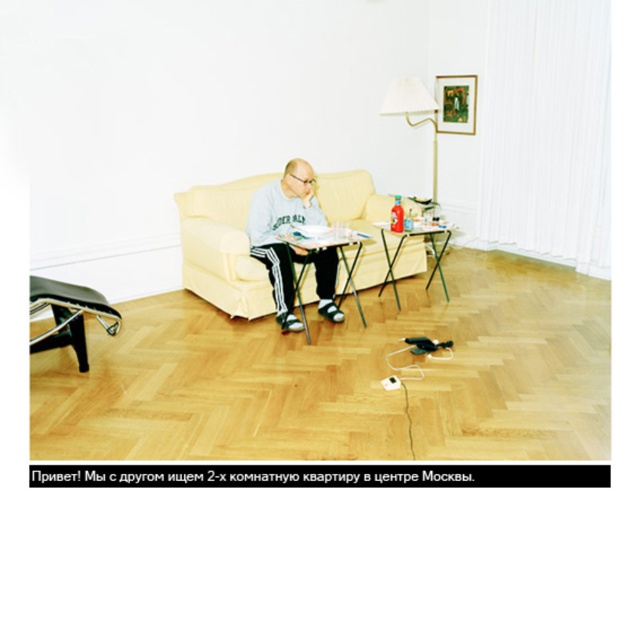
Who is lower down, beige fabric couch at center or green matte picture frame at upper center?

beige fabric couch at center is lower down.

Locate an element on the screen. The height and width of the screenshot is (640, 640). beige fabric couch at center is located at coordinates (221, 248).

Does point (209, 294) lie behind point (474, 112)?

No, (209, 294) is in front of (474, 112).

The image size is (640, 640). Identify the location of beige fabric couch at center. (221, 248).

Is point (186, 230) farther from camera compared to point (269, 257)?

Yes, point (186, 230) is behind point (269, 257).

Is beige fabric couch at center behind gray sweatshirt at center?

That is True.

Between point (378, 240) and point (298, 193), which one is positioned behind?

The point (378, 240) is more distant.

The image size is (640, 640). In order to click on beige fabric couch at center in this screenshot , I will do `click(221, 248)`.

How far apart are beige fabric couch at center and white fabric lampshade at upper center?

A distance of 7.27 feet exists between beige fabric couch at center and white fabric lampshade at upper center.

Can you confirm if beige fabric couch at center is positioned to the left of white fabric lampshade at upper center?

Yes, beige fabric couch at center is to the left of white fabric lampshade at upper center.

This screenshot has width=640, height=640. I want to click on beige fabric couch at center, so click(x=221, y=248).